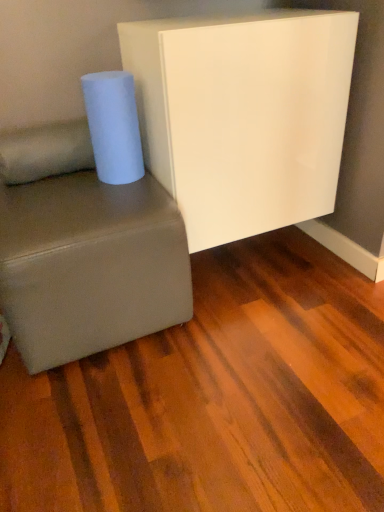
Image resolution: width=384 pixels, height=512 pixels. Identify the location of free location to the left of white matte paper towel at left. (64, 185).